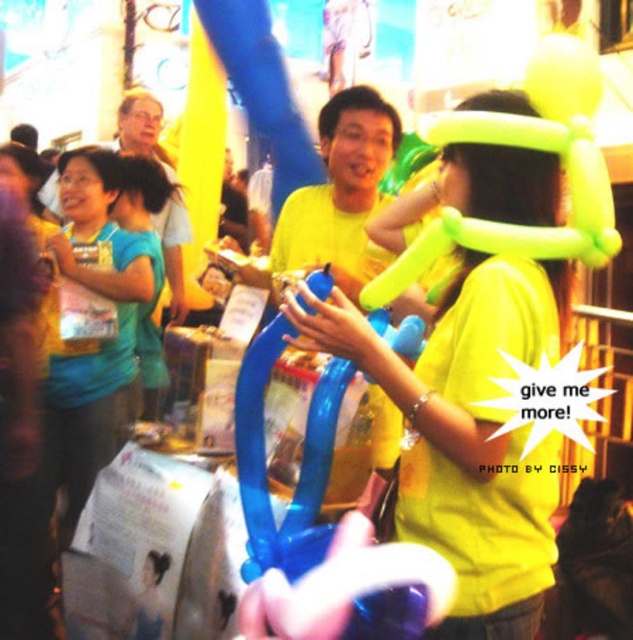
Question: Which point is closer to the camera?

Choices:
 (A) neon yellow balloon at center
 (B) yellow matte balloon at center

Answer: (A)

Question: Which of the following is the closest to the observer?

Choices:
 (A) yellow matte balloon at center
 (B) blue matte shirt at center

Answer: (A)

Question: Is blue matte shirt at center below yellow matte balloon at center?

Choices:
 (A) no
 (B) yes

Answer: (B)

Question: Can you confirm if blue matte shirt at center is wider than yellow matte balloon at center?

Choices:
 (A) yes
 (B) no

Answer: (B)

Question: Can you confirm if neon yellow balloon at center is positioned to the right of blue matte shirt at center?

Choices:
 (A) yes
 (B) no

Answer: (A)

Question: Which object appears farthest from the camera in this image?

Choices:
 (A) blue matte shirt at center
 (B) neon yellow balloon at center

Answer: (A)